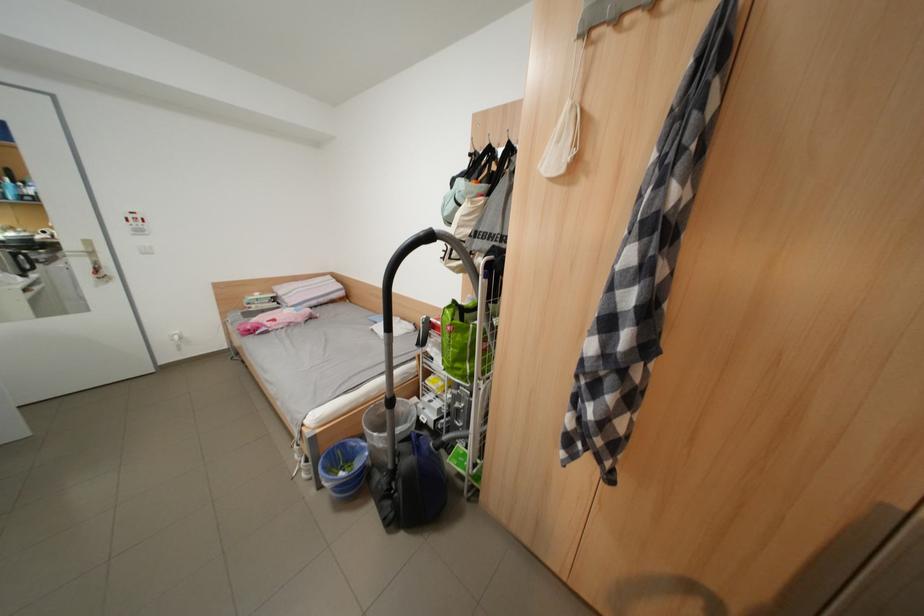
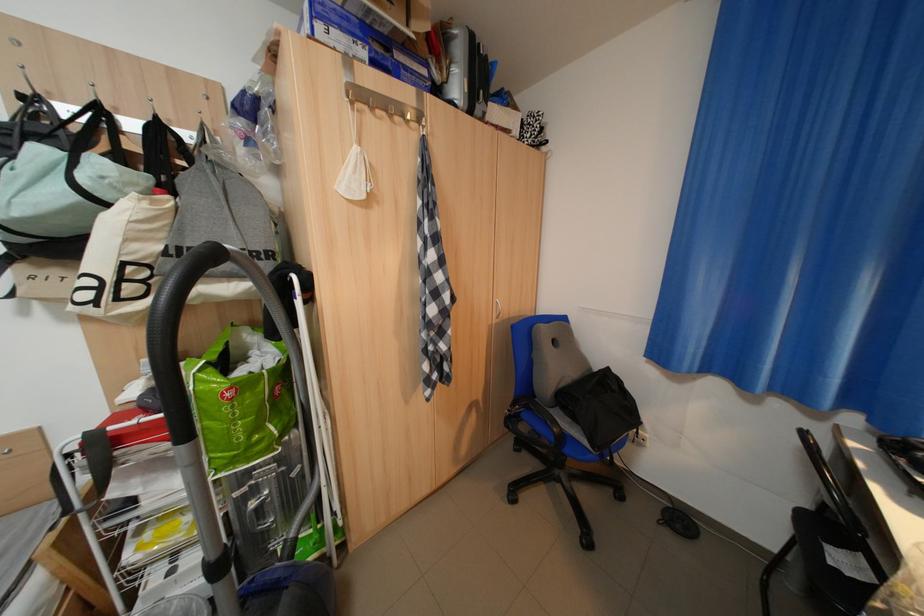
Question: The images are taken continuously from a first-person perspective. In which direction is your viewpoint rotating?

Choices:
 (A) Left
 (B) Right
 (C) Up
 (D) Down

Answer: (B)